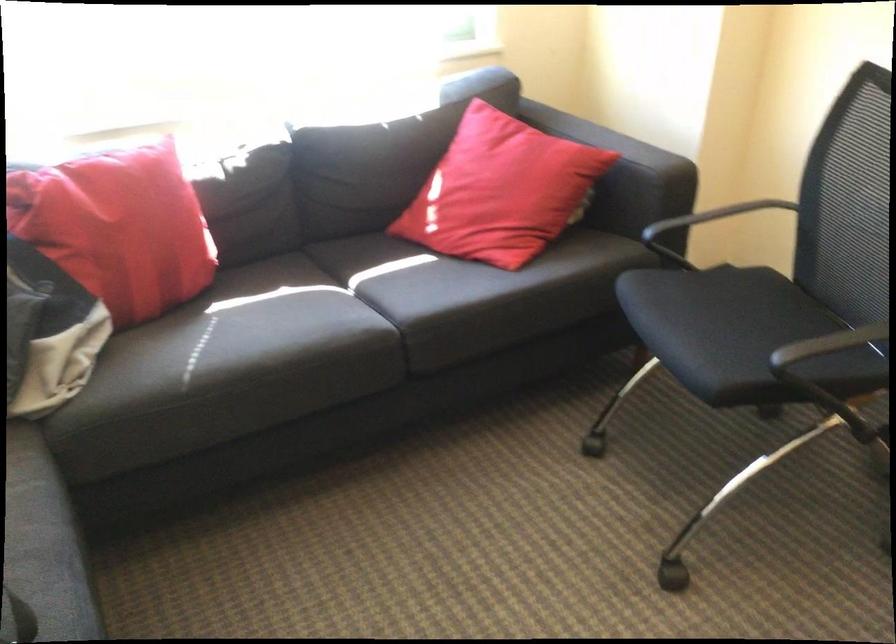
Find the location of a particular element. The image size is (896, 644). sofa armrest is located at coordinates (616, 140).